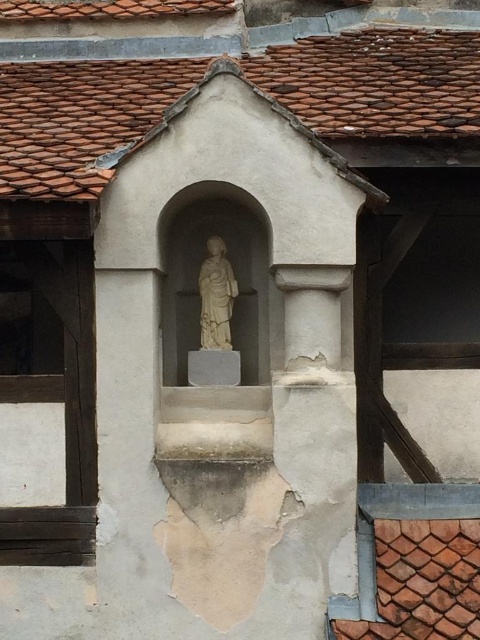
From the picture: You are an architect examining the building facade. You notice the brown clay tiles at upper center and the wooden window at left. Which of these two elements has a larger surface area?

The brown clay tiles at upper center has a larger surface area than the wooden window at left according to the description.

You are an architect examining the building facade. You notice the brown clay tiles at upper center and the wooden window at left. Which object is closer to your current position?

The brown clay tiles at upper center are closer to your current position because they are further to the viewer than the wooden window at left.